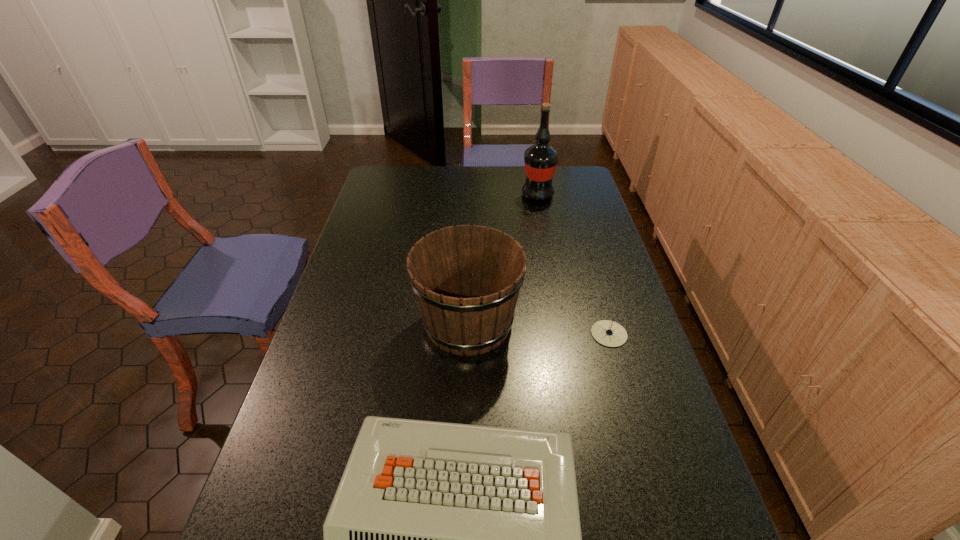
You are a GUI agent. You are given a task and a screenshot of the screen. Output one action in this format:
    pyautogui.click(x=<x>, y=<y>)
    Task: Click on the compass situated at the right edge
    This screenshot has width=960, height=540.
    Given the screenshot: What is the action you would take?
    pyautogui.click(x=608, y=333)

What are the coordinates of `object present at the far right corner` in the screenshot? It's located at (541, 159).

Identify the location of vacant space at the far edge. The height and width of the screenshot is (540, 960). (461, 181).

In order to click on vacant region at the right edge of the desktop in this screenshot , I will do `click(614, 394)`.

Identify the location of vacant area at the far right corner of the desktop. Image resolution: width=960 pixels, height=540 pixels. (561, 181).

I want to click on empty space that is in between the wine bucket and the rightmost object, so click(x=539, y=328).

Where is `free space between the rightmost object and the wine bucket`? Image resolution: width=960 pixels, height=540 pixels. free space between the rightmost object and the wine bucket is located at coordinates (539, 328).

Where is `free space between the rightmost object and the wine bottle`? Image resolution: width=960 pixels, height=540 pixels. free space between the rightmost object and the wine bottle is located at coordinates (573, 265).

You are a GUI agent. You are given a task and a screenshot of the screen. Output one action in this format:
    pyautogui.click(x=<x>, y=<y>)
    Task: Click on the object that is the closest to the wine bucket
    The image size is (960, 540).
    Given the screenshot: What is the action you would take?
    pyautogui.click(x=443, y=539)

Image resolution: width=960 pixels, height=540 pixels. I want to click on object that stands as the second closest to the second tallest object, so click(608, 333).